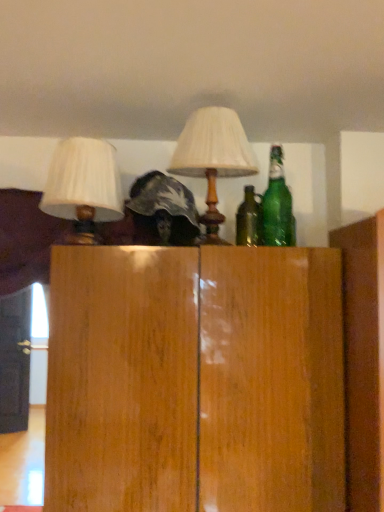
Question: Is green glass bottle at upper right bigger or smaller than wooden door at left?

Choices:
 (A) small
 (B) big

Answer: (A)

Question: From their relative heights in the image, would you say green glass bottle at upper right is taller or shorter than wooden door at left?

Choices:
 (A) short
 (B) tall

Answer: (A)

Question: Based on their relative distances, which object is nearer to the green glass bottle at upper right?

Choices:
 (A) matte white lampshade at center, the 1th lamp when ordered from right to left
 (B) wooden door at left
 (C) white fabric lampshade at upper left, which ranks as the 1th lamp in left-to-right order

Answer: (A)

Question: Estimate the real-world distances between objects in this image. Which object is closer to the white fabric lampshade at upper left, which ranks as the 1th lamp in left-to-right order?

Choices:
 (A) green glass bottle at upper right
 (B) matte white lampshade at center, which appears as the 2th lamp when viewed from the left
 (C) wooden door at left

Answer: (B)